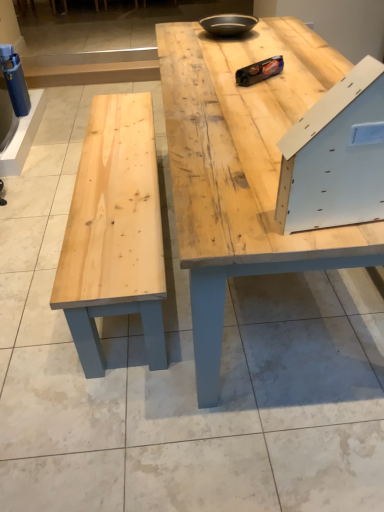
At what (x,y) coordinates should I click in order to perform the action: click on vacant space situated on the left part of matte black bowl at upper center. Please return your answer as a coordinate pair (x, y). Looking at the image, I should click on (183, 37).